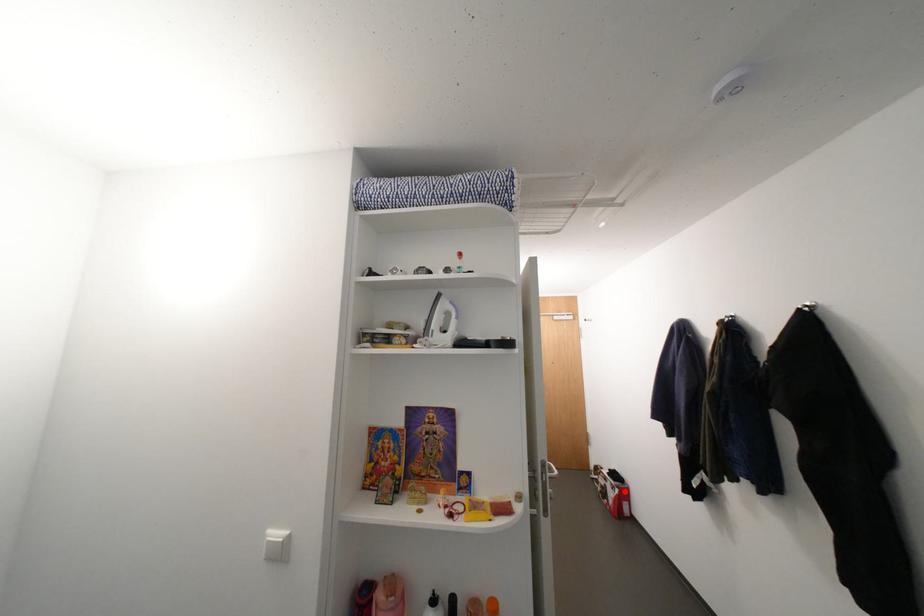
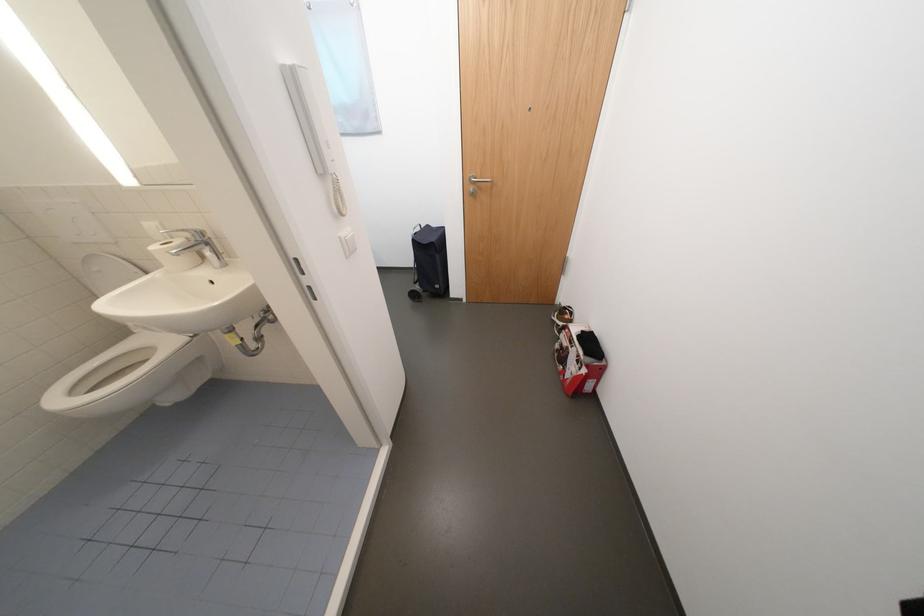
The point at the highlighted location is marked in the first image. Where is the corresponding point in the second image?

(592, 371)